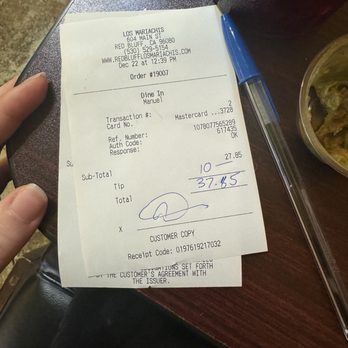
Locate an element on the screen. This screenshot has height=348, width=348. wood table is located at coordinates (43, 146).